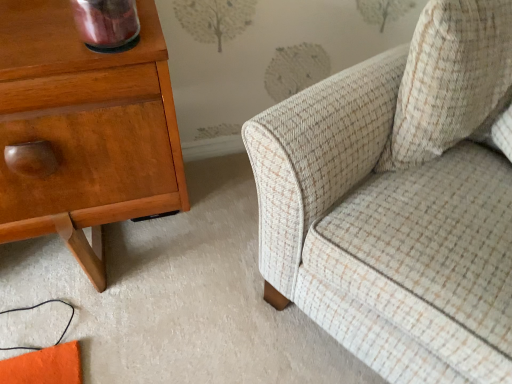
Based on the photo, measure the distance between beige textured cushion at upper right and camera.

beige textured cushion at upper right and camera are 73.90 centimeters apart from each other.

The image size is (512, 384). What are the coordinates of `beige textured cushion at upper right` in the screenshot? It's located at (451, 79).

Does beige textured cushion at upper right appear on the right side of shiny wood nightstand at left?

Indeed, beige textured cushion at upper right is positioned on the right side of shiny wood nightstand at left.

Can you confirm if beige textured cushion at upper right is taller than shiny wood nightstand at left?

In fact, beige textured cushion at upper right may be shorter than shiny wood nightstand at left.

Is point (475, 123) positioned after point (129, 112)?

Yes, point (475, 123) is behind point (129, 112).

Can you confirm if beige textured cushion at upper right is bigger than shiny wood nightstand at left?

Incorrect, beige textured cushion at upper right is not larger than shiny wood nightstand at left.

Considering the points (425, 29) and (397, 88), which point is in front, point (425, 29) or point (397, 88)?

Positioned in front is point (425, 29).

From the image's perspective, is beige textured cushion at upper right under beige tweed sofa at right?

Actually, beige textured cushion at upper right appears above beige tweed sofa at right in the image.

From a real-world perspective, who is located higher, beige textured cushion at upper right or beige tweed sofa at right?

beige textured cushion at upper right, from a real-world perspective.

From the picture: Considering the positions of objects beige textured cushion at upper right and beige tweed sofa at right in the image provided, who is behind, beige textured cushion at upper right or beige tweed sofa at right?

beige textured cushion at upper right is more distant.

Can you confirm if beige tweed sofa at right is wider than shiny wood nightstand at left?

Yes, beige tweed sofa at right is wider than shiny wood nightstand at left.

Is beige tweed sofa at right positioned beyond the bounds of shiny wood nightstand at left?

beige tweed sofa at right lies outside shiny wood nightstand at left's area.

Does beige tweed sofa at right appear on the left side of shiny wood nightstand at left?

In fact, beige tweed sofa at right is to the right of shiny wood nightstand at left.

The height and width of the screenshot is (384, 512). Find the location of `chair that is above the shiny wood nightstand at left (from a real-world perspective)`. chair that is above the shiny wood nightstand at left (from a real-world perspective) is located at coordinates (399, 200).

Between beige tweed sofa at right and beige textured cushion at upper right, which one has larger size?

Bigger between the two is beige tweed sofa at right.

Between point (463, 317) and point (436, 123), which one is positioned in front?

The point (463, 317) is closer.

Which is more to the left, beige tweed sofa at right or beige textured cushion at upper right?

beige textured cushion at upper right is more to the left.

Is beige tweed sofa at right located outside beige textured cushion at upper right?

beige tweed sofa at right lies outside beige textured cushion at upper right's area.

Considering the relative sizes of shiny wood nightstand at left and beige tweed sofa at right in the image provided, is shiny wood nightstand at left shorter than beige tweed sofa at right?

Yes.

From a real-world perspective, is shiny wood nightstand at left above or below beige tweed sofa at right?

shiny wood nightstand at left is below beige tweed sofa at right.

Which point is more distant from viewer, (x=50, y=17) or (x=340, y=186)?

The point (x=340, y=186) is behind.

What's the angular difference between shiny wood nightstand at left and beige textured cushion at upper right's facing directions?

shiny wood nightstand at left and beige textured cushion at upper right are facing 15 degrees away from each other.

Which is more to the right, shiny wood nightstand at left or beige textured cushion at upper right?

beige textured cushion at upper right is more to the right.

From the image's perspective, is shiny wood nightstand at left located above beige textured cushion at upper right?

No, from the image's perspective, shiny wood nightstand at left is not on top of beige textured cushion at upper right.

Considering the sizes of objects shiny wood nightstand at left and beige textured cushion at upper right in the image provided, who is wider, shiny wood nightstand at left or beige textured cushion at upper right?

shiny wood nightstand at left.

The width and height of the screenshot is (512, 384). In order to click on nightstand beneath the beige textured cushion at upper right (from a real-world perspective) in this screenshot , I will do `click(85, 129)`.

Identify the location of throw pillow that is above the beige tweed sofa at right (from the image's perspective). (451, 79).

Estimate the real-world distances between objects in this image. Which object is closer to shiny wood nightstand at left, beige textured cushion at upper right or beige tweed sofa at right?

beige tweed sofa at right.

Considering their positions, is beige textured cushion at upper right positioned closer to beige tweed sofa at right than shiny wood nightstand at left?

Among the two, beige textured cushion at upper right is located nearer to beige tweed sofa at right.

Looking at the image, which one is located further to beige textured cushion at upper right, shiny wood nightstand at left or beige tweed sofa at right?

Based on the image, shiny wood nightstand at left appears to be further to beige textured cushion at upper right.

Looking at the image, which one is located further to beige tweed sofa at right, shiny wood nightstand at left or beige textured cushion at upper right?

The object further to beige tweed sofa at right is shiny wood nightstand at left.

Which object lies nearer to the anchor point shiny wood nightstand at left, beige tweed sofa at right or beige textured cushion at upper right?

Among the two, beige tweed sofa at right is located nearer to shiny wood nightstand at left.

When comparing their distances from beige textured cushion at upper right, does beige tweed sofa at right or shiny wood nightstand at left seem closer?

beige tweed sofa at right lies closer to beige textured cushion at upper right than the other object.

This screenshot has height=384, width=512. In order to click on throw pillow between shiny wood nightstand at left and beige tweed sofa at right from left to right in this screenshot , I will do `click(451, 79)`.